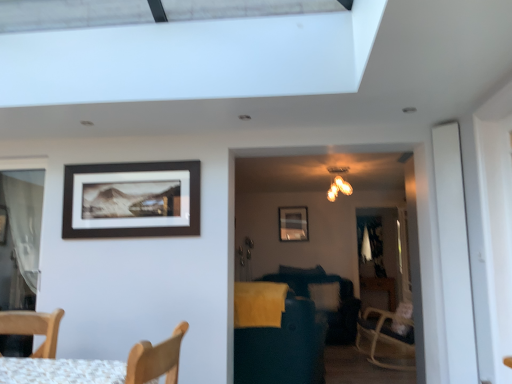
Question: Should I look upward or downward to see matte gold chandelier at upper center?

Choices:
 (A) down
 (B) up

Answer: (B)

Question: Can you confirm if dark blue fabric swivel chair at center is taller than matte gold chandelier at upper center?

Choices:
 (A) yes
 (B) no

Answer: (A)

Question: Does dark blue fabric swivel chair at center contain matte gold chandelier at upper center?

Choices:
 (A) yes
 (B) no

Answer: (B)

Question: From a real-world perspective, is dark blue fabric swivel chair at center beneath matte gold chandelier at upper center?

Choices:
 (A) no
 (B) yes

Answer: (B)

Question: Is dark blue fabric swivel chair at center looking in the opposite direction of matte gold chandelier at upper center?

Choices:
 (A) yes
 (B) no

Answer: (B)

Question: Is dark blue fabric swivel chair at center to the right of matte gold chandelier at upper center from the viewer's perspective?

Choices:
 (A) no
 (B) yes

Answer: (A)

Question: Considering the relative positions of dark blue fabric swivel chair at center and matte gold chandelier at upper center in the image provided, is dark blue fabric swivel chair at center behind matte gold chandelier at upper center?

Choices:
 (A) yes
 (B) no

Answer: (B)

Question: Is matte black picture frame at upper center, marked as the 1th picture frame in a front-to-back arrangement, next to matte black picture frame at upper center, positioned as the 2th picture frame in front-to-back order?

Choices:
 (A) yes
 (B) no

Answer: (B)

Question: Does matte black picture frame at upper center, positioned as the 1th picture frame in top-to-bottom order, appear on the right side of matte black picture frame at upper center, which ranks as the first picture frame in bottom-to-top order?

Choices:
 (A) no
 (B) yes

Answer: (A)

Question: From the image's perspective, is matte black picture frame at upper center, marked as the 1th picture frame in a front-to-back arrangement, over matte black picture frame at upper center, which ranks as the 1th picture frame in right-to-left order?

Choices:
 (A) yes
 (B) no

Answer: (A)

Question: From a real-world perspective, is matte black picture frame at upper center, positioned as the 1th picture frame in top-to-bottom order, located higher than matte black picture frame at upper center, which ranks as the first picture frame in bottom-to-top order?

Choices:
 (A) yes
 (B) no

Answer: (B)

Question: Is matte black picture frame at upper center, which is the 2th picture frame from back to front, smaller than matte black picture frame at upper center, which is counted as the 2th picture frame, starting from the top?

Choices:
 (A) yes
 (B) no

Answer: (B)

Question: Considering the relative positions of matte black picture frame at upper center, which is the 2th picture frame in bottom-to-top order, and matte black picture frame at upper center, which is counted as the 2th picture frame, starting from the top, in the image provided, is matte black picture frame at upper center, which is the 2th picture frame in bottom-to-top order, to the left of matte black picture frame at upper center, which is counted as the 2th picture frame, starting from the top, from the viewer's perspective?

Choices:
 (A) yes
 (B) no

Answer: (A)

Question: Is dark blue fabric swivel chair at center far away from matte black picture frame at upper center, placed as the 2th picture frame when sorted from left to right?

Choices:
 (A) yes
 (B) no

Answer: (A)